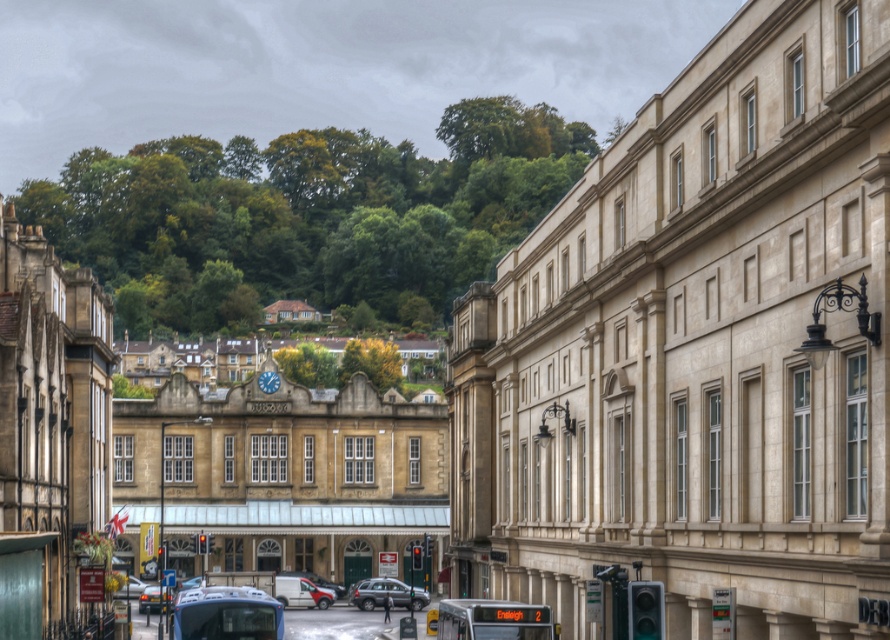
The height and width of the screenshot is (640, 890). What are the coordinates of `metallic silver bus at lower center` in the screenshot? It's located at (227, 612).

Find the location of `metallic silver bus at lower center`. metallic silver bus at lower center is located at coordinates (227, 612).

Can you confirm if metallic silver bus at center is positioned above matte black car at lower left?

Yes, metallic silver bus at center is above matte black car at lower left.

Find the location of a particular element. metallic silver bus at center is located at coordinates (492, 620).

This screenshot has width=890, height=640. What are the coordinates of `metallic silver bus at center` in the screenshot? It's located at (492, 620).

Does matte black car at lower left have a larger size compared to silver metallic van at center?

Yes, matte black car at lower left is bigger than silver metallic van at center.

The image size is (890, 640). Find the location of `matte black car at lower left`. matte black car at lower left is located at coordinates (155, 600).